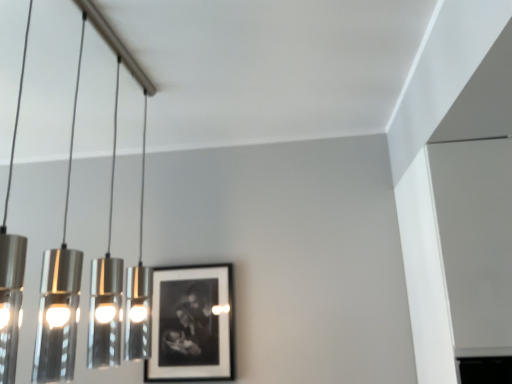
Question: Is polished silver pendant lights at left wider or thinner than black matte picture frame at center?

Choices:
 (A) thin
 (B) wide

Answer: (B)

Question: Is polished silver pendant lights at left spatially inside black matte picture frame at center, or outside of it?

Choices:
 (A) outside
 (B) inside

Answer: (A)

Question: Considering the relative positions of polished silver pendant lights at left and black matte picture frame at center in the image provided, is polished silver pendant lights at left to the left or to the right of black matte picture frame at center?

Choices:
 (A) left
 (B) right

Answer: (A)

Question: Is black matte picture frame at center bigger or smaller than polished silver pendant lights at left?

Choices:
 (A) small
 (B) big

Answer: (A)

Question: Considering the relative positions of black matte picture frame at center and polished silver pendant lights at left in the image provided, is black matte picture frame at center to the left or to the right of polished silver pendant lights at left?

Choices:
 (A) right
 (B) left

Answer: (A)

Question: Is black matte picture frame at center inside or outside of polished silver pendant lights at left?

Choices:
 (A) inside
 (B) outside

Answer: (B)

Question: Relative to polished silver pendant lights at left, is black matte picture frame at center in front or behind?

Choices:
 (A) front
 (B) behind

Answer: (B)